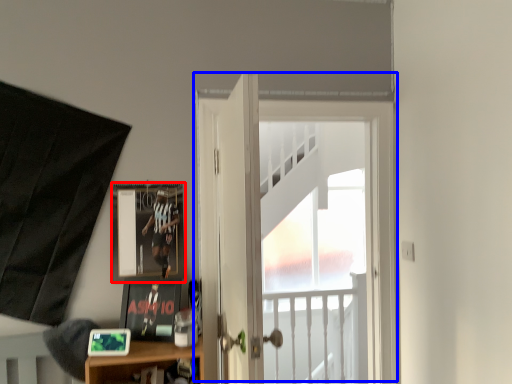
Question: Which object appears closest to the camera in this image, picture frame (highlighted by a red box) or door (highlighted by a blue box)?

Choices:
 (A) picture frame
 (B) door

Answer: (A)